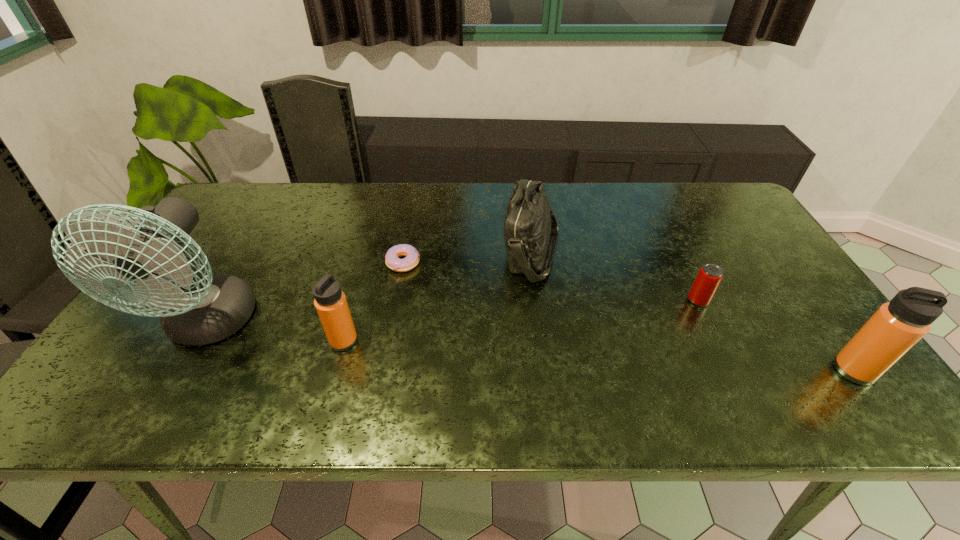
Locate an element on the screen. This screenshot has width=960, height=540. vacant point that satisfies the following two spatial constraints: 1. in front of the tallest object where the airflow is directed; 2. on the right side of the second object from left to right is located at coordinates coord(199,341).

You are a GUI agent. You are given a task and a screenshot of the screen. Output one action in this format:
    pyautogui.click(x=<x>, y=<y>)
    Task: Click on the free space that satisfies the following two spatial constraints: 1. at the front padded panel of the fourth object from left to right; 2. in front of the tallest object where the airflow is directed
    Image resolution: width=960 pixels, height=540 pixels.
    Given the screenshot: What is the action you would take?
    pyautogui.click(x=540, y=325)

This screenshot has width=960, height=540. I want to click on vacant space that satisfies the following two spatial constraints: 1. at the front padded panel of the shoulder bag; 2. on the back side of the right thermos bottle, so click(546, 370).

I want to click on vacant region that satisfies the following two spatial constraints: 1. on the back side of the fourth object from right to left; 2. on the right side of the fifth object from right to left, so (x=366, y=262).

This screenshot has height=540, width=960. I want to click on vacant region that satisfies the following two spatial constraints: 1. at the front padded panel of the right thermos bottle; 2. on the right side of the shoulder bag, so click(546, 370).